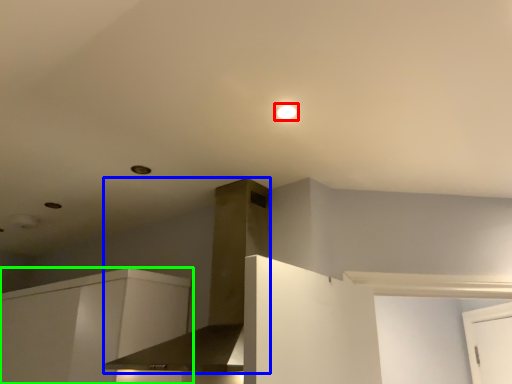
Question: Considering the real-world distances, which object is closest to lighting (highlighted by a red box)? vent (highlighted by a blue box) or cabinetry (highlighted by a green box).

Choices:
 (A) vent
 (B) cabinetry

Answer: (A)